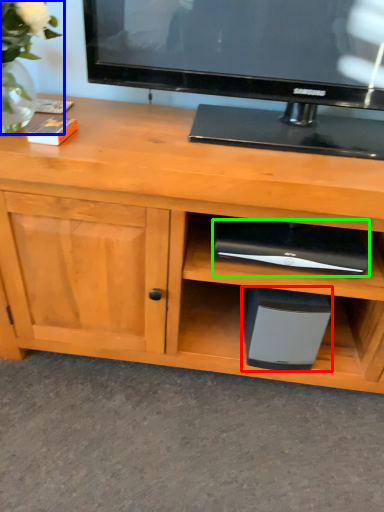
Question: Which object is the closest to the appliance (highlighted by a red box)? Choose among these: floral arrangement (highlighted by a blue box) or appliance (highlighted by a green box).

Choices:
 (A) floral arrangement
 (B) appliance

Answer: (B)